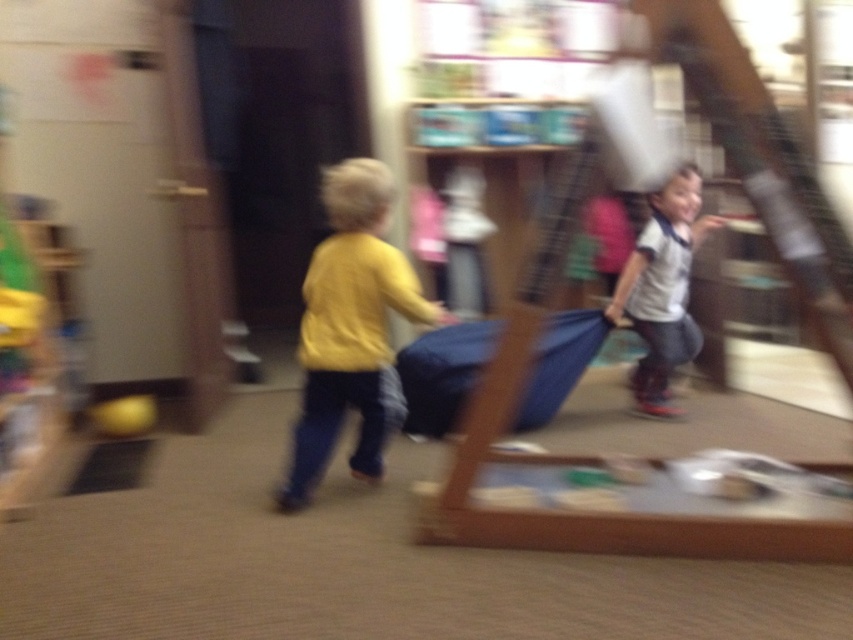
Consider the image. You are a photographer who just took a photo of two children in a playroom. In the image, you notice the yellow matte shirt at left and the white matte shirt at right. Based on the scene description, which child is taller?

The yellow matte shirt at left is taller than the white matte shirt at right, so the child wearing the yellow matte shirt at left is taller.